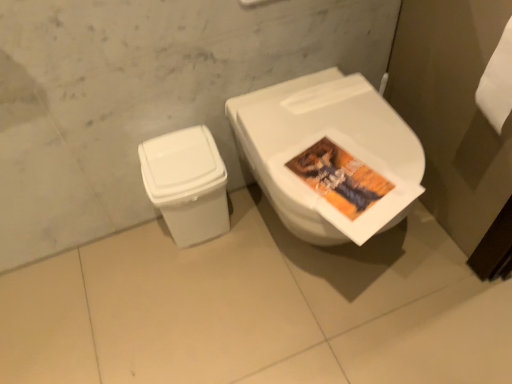
This screenshot has height=384, width=512. What are the coordinates of `free region on the left part of white plastic trash can at lower left` in the screenshot? It's located at (134, 250).